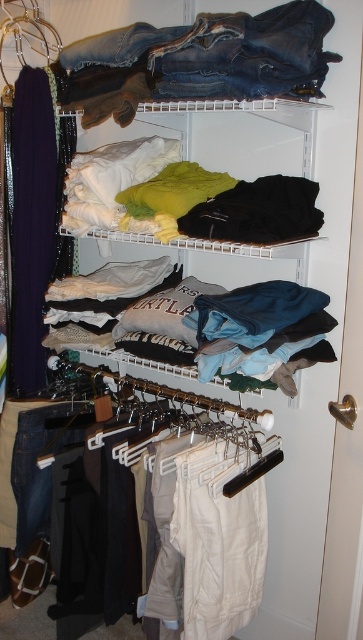
You are standing in front of the closet and want to reach two points inside the closet. The first point is point (218, 67) and the second point is point (313, 316). Which point is closer to you?

Point (218, 67) is closer to the viewer than point (313, 316).